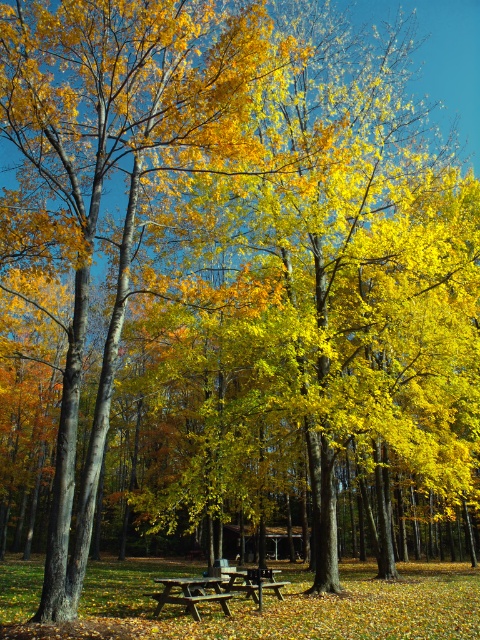
You are standing at the picnic table and want to pick up an object located at point (266, 580) and another object at point (165, 596). Which object will require you to move forward less to reach?

Point (266, 580) is closer to you than point (165, 596), so you will need to move forward less to reach the object at point (266, 580).

You are planning to set up a blanket under the wooden picnic table at center and the wooden picnic table at lower center. Which table should you choose if you want to have enough space to comfortably spread out your blanket underneath?

The wooden picnic table at center is much taller than the wooden picnic table at lower center, so you should choose the wooden picnic table at center to have enough space to comfortably spread out your blanket underneath.